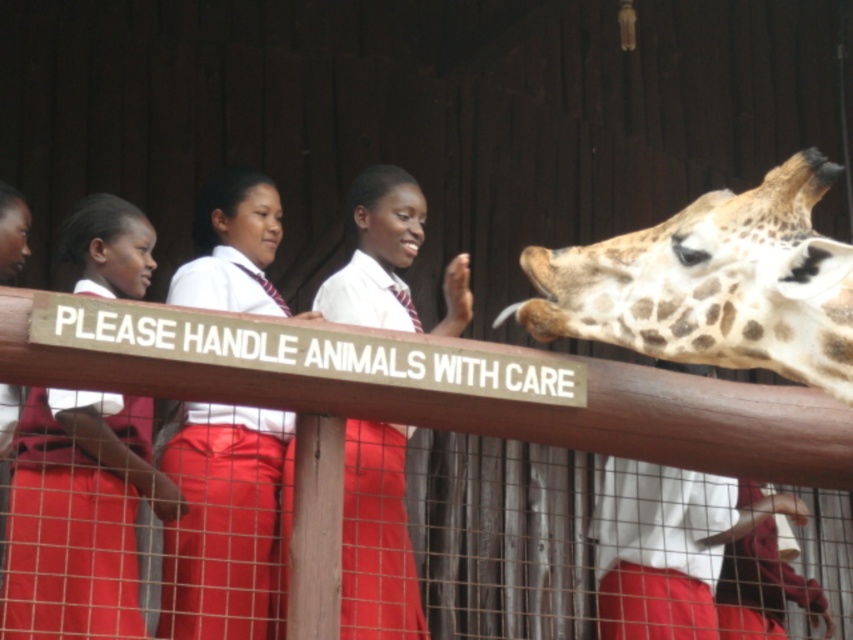
Does brown wooden fence at upper center have a greater width compared to matte red uniform at center?

Indeed, brown wooden fence at upper center has a greater width compared to matte red uniform at center.

Between point (440, 420) and point (12, 608), which one is positioned in front?

Point (440, 420) is more forward.

Where is `brown wooden fence at upper center`? brown wooden fence at upper center is located at coordinates (508, 406).

Is spotted fur giraffe at right wider than matte white shirt at center?

No.

Is point (527, 264) farther from camera compared to point (190, 458)?

That is False.

Describe the element at coordinates (712, 284) in the screenshot. I see `spotted fur giraffe at right` at that location.

Identify the location of spotted fur giraffe at right. (712, 284).

Identify the location of spotted fur giraffe at right. The image size is (853, 640). (712, 284).

Who is more forward, (x=807, y=150) or (x=137, y=285)?

Point (x=807, y=150) is in front.

Is point (637, 346) more distant than point (108, 582)?

No.

You are a GUI agent. You are given a task and a screenshot of the screen. Output one action in this format:
    pyautogui.click(x=<x>, y=<y>)
    Task: Click on the spotted fur giraffe at right
    This screenshot has width=853, height=640.
    Given the screenshot: What is the action you would take?
    712,284